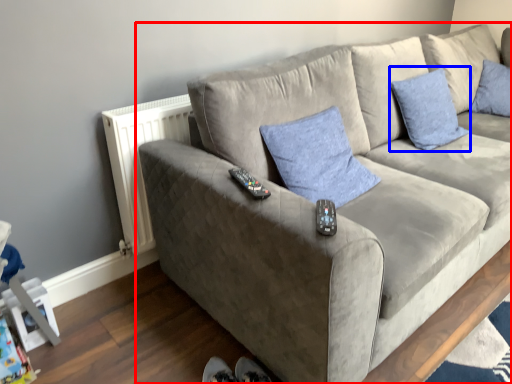
Question: Which of the following is the farthest to the observer, studio couch (highlighted by a red box) or pillow (highlighted by a blue box)?

Choices:
 (A) studio couch
 (B) pillow

Answer: (B)